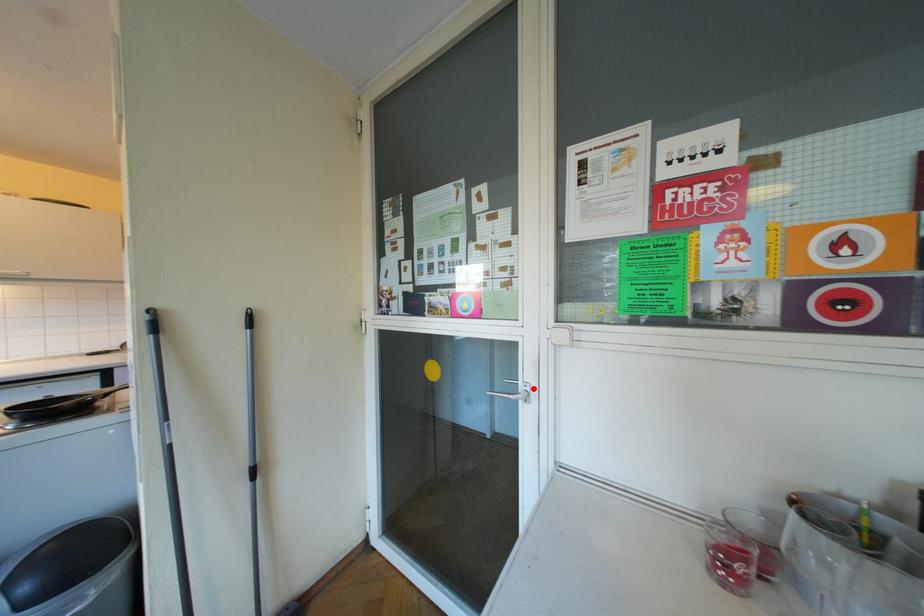
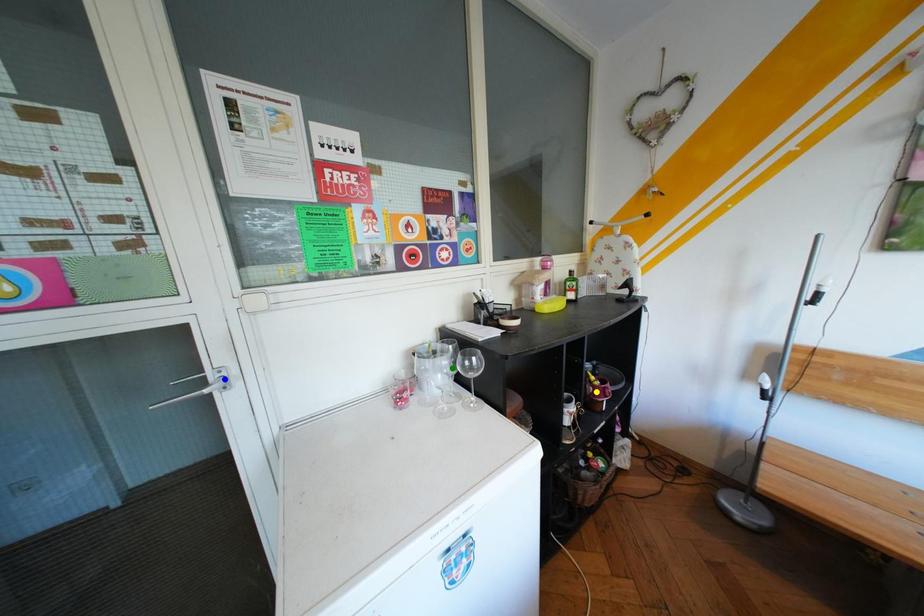
Question: I am providing you with two images of the same scene from different viewpoints. A red point is marked on the first image. You are given multiple points on the second image. Which spot in image 2 lines up with the point in image 1?

Choices:
 (A) blue point
 (B) yellow point
 (C) green point

Answer: (A)